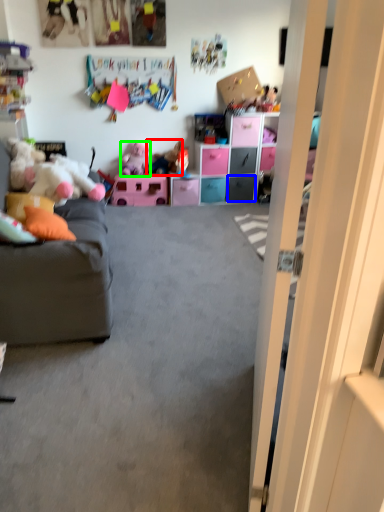
Question: Which is nearer to the toy (highlighted by a red box)? drawer (highlighted by a blue box) or toy (highlighted by a green box).

Choices:
 (A) drawer
 (B) toy

Answer: (B)